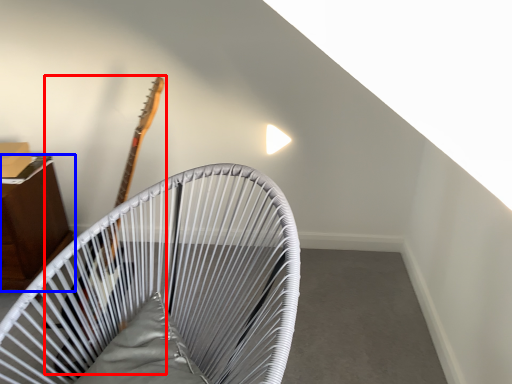
Question: Which point is further to the camera, guitar (highlighted by a red box) or furniture (highlighted by a blue box)?

Choices:
 (A) guitar
 (B) furniture

Answer: (B)